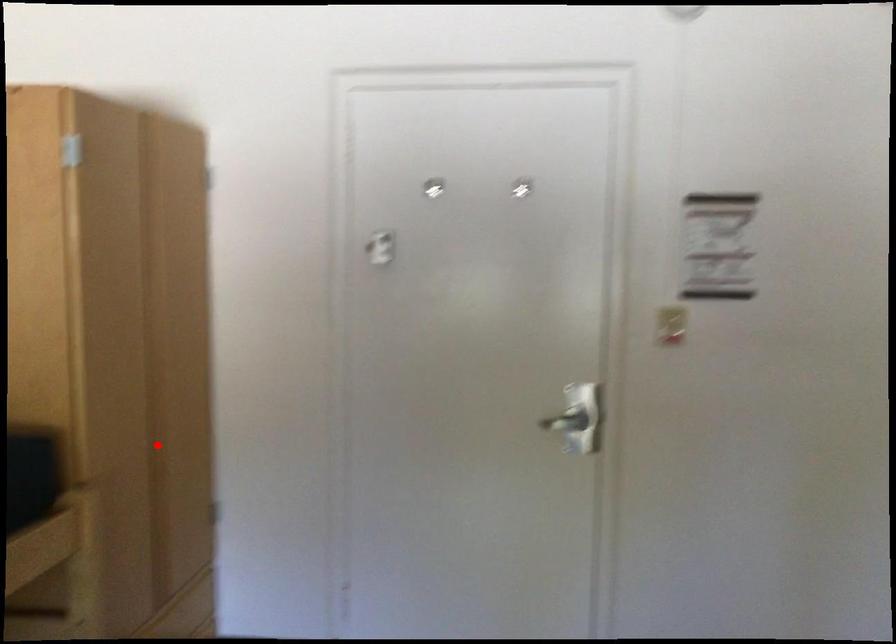
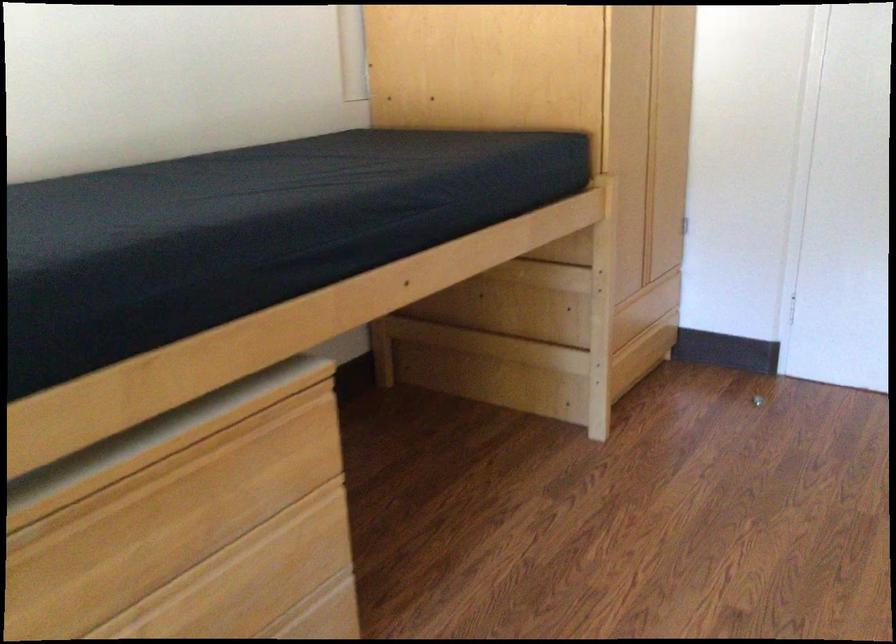
Locate, in the second image, the point that corresponds to the highlighted location in the first image.

(648, 160)